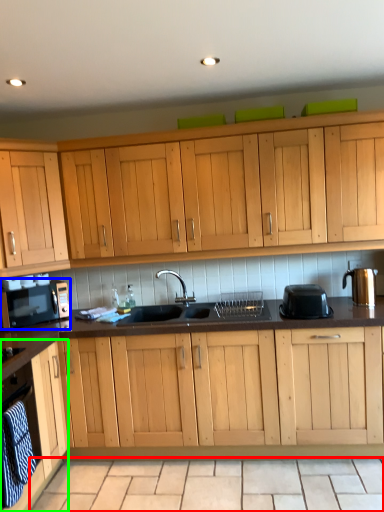
Question: Based on their relative distances, which object is nearer to tile (highlighted by a red box)? Choose from home appliance (highlighted by a blue box) and cabinetry (highlighted by a green box).

Choices:
 (A) home appliance
 (B) cabinetry

Answer: (B)